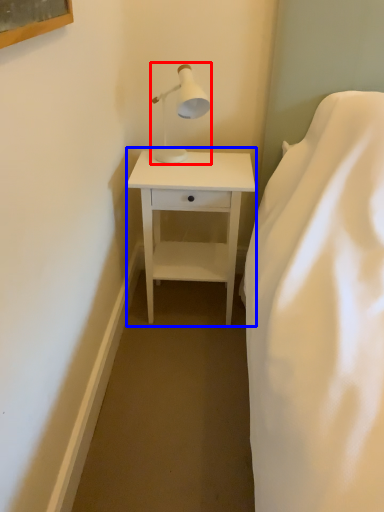
Question: Which object is closer to the camera taking this photo, table lamp (highlighted by a red box) or nightstand (highlighted by a blue box)?

Choices:
 (A) table lamp
 (B) nightstand

Answer: (A)